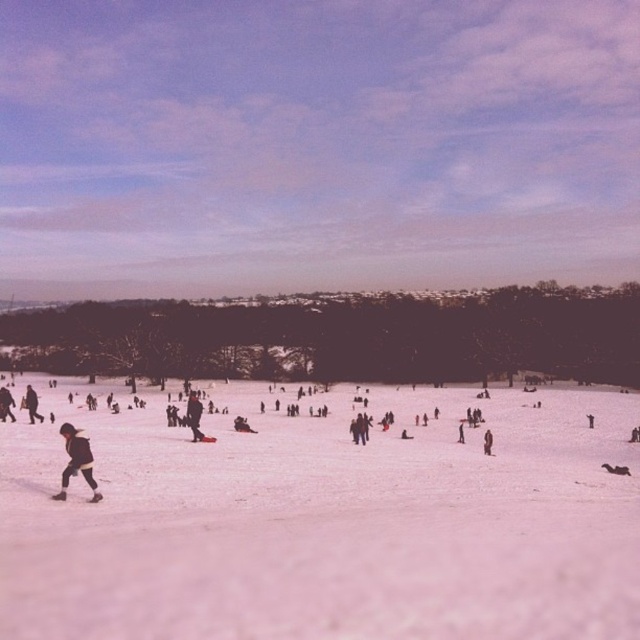
You are standing in the snowy landscape and want to see the brown woolen coat at center without moving. Can you see it clearly from your current position, considering the dark brown leather jacket at lower left?

The brown woolen coat at center is behind the dark brown leather jacket at lower left, so it might be partially or fully blocked from view depending on their positions.

You are standing at the point marked by point (193, 416) in the snowy landscape. Looking around, you see a black matte jacket at center. Which direction should you walk to reach the dense line of dark trees in the midground?

The dense line of dark trees in the midground is located behind the black matte jacket at center. So you should walk forward from the point marked by point (193, 416) towards the direction of the trees.

You are standing in the snowy landscape and want to walk towards the dark brown leather jacket at lower left. Will the white snow at center block your path?

The white snow at center is in front of the dark brown leather jacket at lower left, so it will block your path to the jacket.